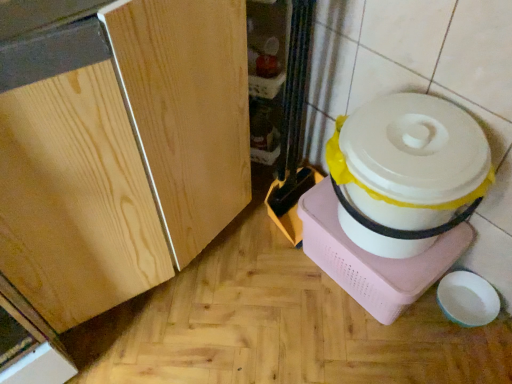
Question: Looking at the image, does white plastic rice cooker at right seem bigger or smaller compared to light wood cabinet at center?

Choices:
 (A) big
 (B) small

Answer: (B)

Question: Is point (381, 175) closer or farther from the camera than point (210, 157)?

Choices:
 (A) closer
 (B) farther

Answer: (A)

Question: Relative to light wood cabinet at center, is white plastic rice cooker at right in front or behind?

Choices:
 (A) front
 (B) behind

Answer: (B)

Question: In the image, is light wood cabinet at center on the left side or the right side of white plastic rice cooker at right?

Choices:
 (A) right
 (B) left

Answer: (B)

Question: In terms of width, does light wood cabinet at center look wider or thinner when compared to white plastic rice cooker at right?

Choices:
 (A) thin
 (B) wide

Answer: (B)

Question: Considering their positions, is light wood cabinet at center located in front of or behind white plastic rice cooker at right?

Choices:
 (A) behind
 (B) front

Answer: (B)

Question: From a real-world perspective, is light wood cabinet at center physically located above or below white plastic rice cooker at right?

Choices:
 (A) below
 (B) above

Answer: (B)